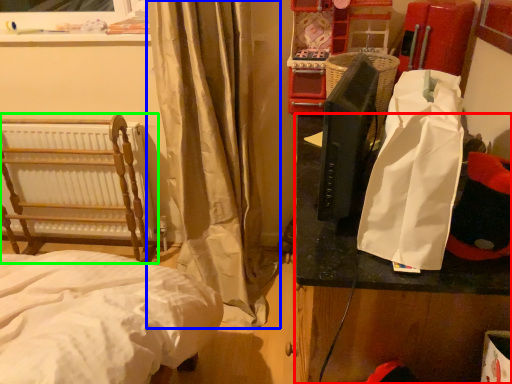
Question: Estimate the real-world distances between objects in this image. Which object is closer to table (highlighted by a red box), curtain (highlighted by a blue box) or furniture (highlighted by a green box)?

Choices:
 (A) curtain
 (B) furniture

Answer: (A)